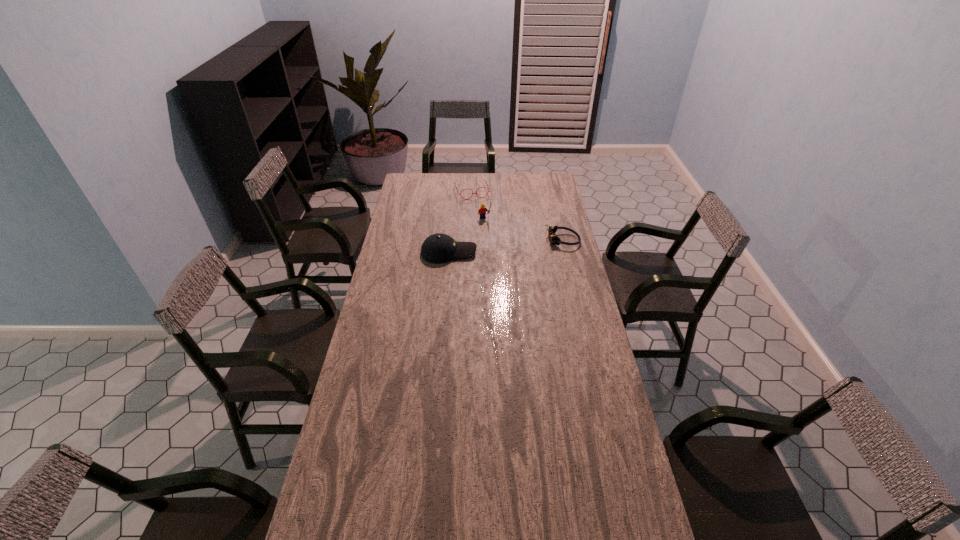
Locate an element on the screen. vacant spot on the desktop that is between the baseball cap and the goggles and is positioned on the front-facing side of the farthest object is located at coordinates (493, 247).

In order to click on vacant space on the desktop that is between the second tallest object and the rightmost object and is positioned on the front-facing side of the tallest object in this screenshot , I will do `click(505, 246)`.